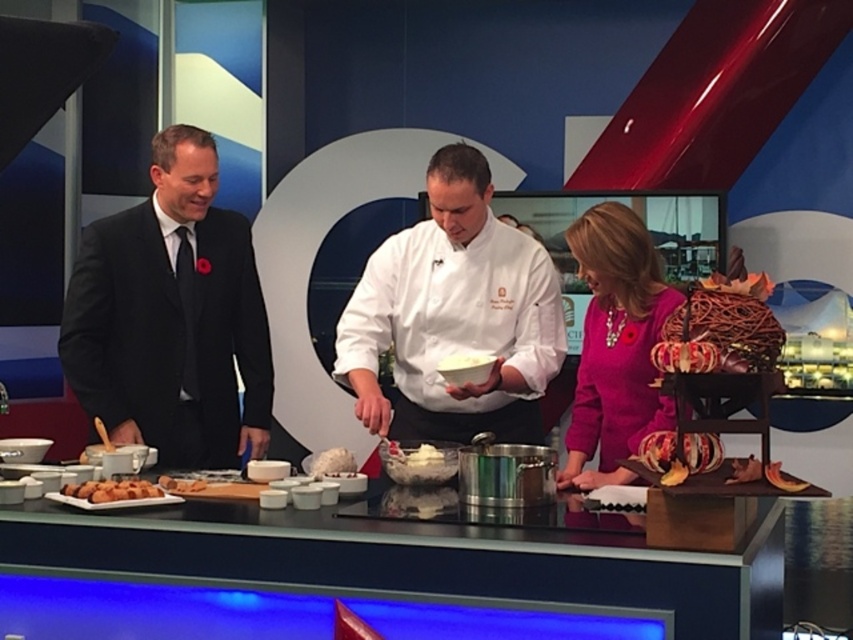
Question: Which point appears farthest from the camera in this image?

Choices:
 (A) (262, 312)
 (B) (659, 362)
 (C) (143, 493)
 (D) (419, 436)

Answer: (A)

Question: Is shiny metallic bowl at center closer to the viewer compared to white fluffy cloud at center?

Choices:
 (A) yes
 (B) no

Answer: (A)

Question: Is shiny metallic bowl at center above white fluffy cloud at center?

Choices:
 (A) no
 (B) yes

Answer: (B)

Question: Among these objects, which one is nearest to the camera?

Choices:
 (A) white matte chef coat at center
 (B) shiny red onions at right

Answer: (B)

Question: Which point appears farthest from the camera in this image?

Choices:
 (A) (653, 435)
 (B) (312, 467)

Answer: (B)

Question: Is black suit at left further to the viewer compared to white fluffy cloud at center?

Choices:
 (A) yes
 (B) no

Answer: (A)